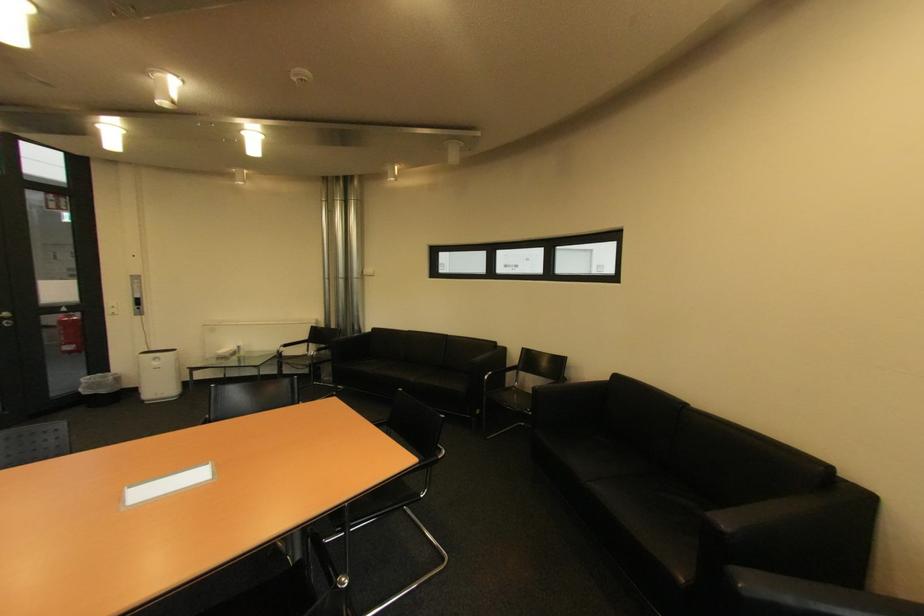
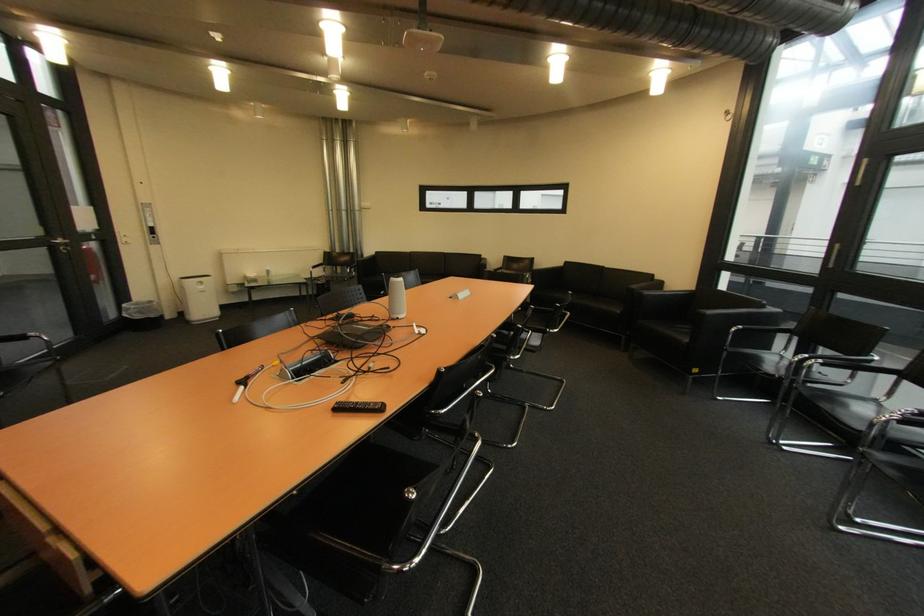
Find the pixel in the second image that matches the point at 94,394 in the first image.

(147, 318)